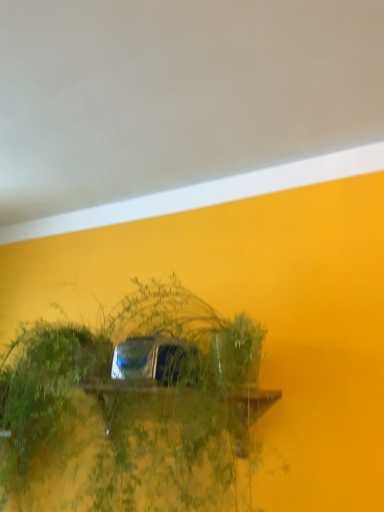
Question: Is green leafy plant at center spatially inside matte yellow wall at upper center, or outside of it?

Choices:
 (A) inside
 (B) outside

Answer: (B)

Question: Looking at their shapes, would you say green leafy plant at center is wider or thinner than matte yellow wall at upper center?

Choices:
 (A) wide
 (B) thin

Answer: (B)

Question: Considering the positions of green leafy plant at center and matte yellow wall at upper center in the image, is green leafy plant at center bigger or smaller than matte yellow wall at upper center?

Choices:
 (A) big
 (B) small

Answer: (A)

Question: Which is correct: matte yellow wall at upper center is inside green leafy plant at center, or outside of it?

Choices:
 (A) inside
 (B) outside

Answer: (B)

Question: Is matte yellow wall at upper center to the left or to the right of green leafy plant at center in the image?

Choices:
 (A) left
 (B) right

Answer: (A)

Question: From a real-world perspective, is matte yellow wall at upper center physically located above or below green leafy plant at center?

Choices:
 (A) below
 (B) above

Answer: (B)

Question: Looking at the image, does matte yellow wall at upper center seem bigger or smaller compared to green leafy plant at center?

Choices:
 (A) big
 (B) small

Answer: (B)